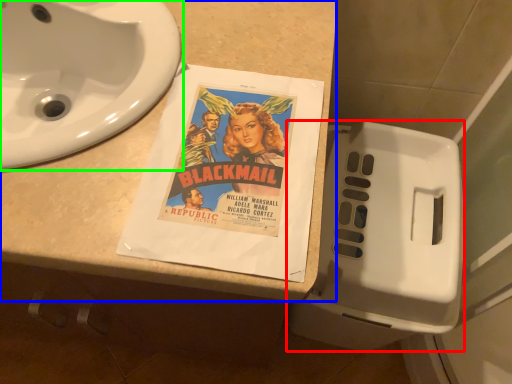
Question: Based on their relative distances, which object is nearer to toilet (highlighted by a red box)? Choose from counter top (highlighted by a blue box) and sink (highlighted by a green box).

Choices:
 (A) counter top
 (B) sink

Answer: (A)